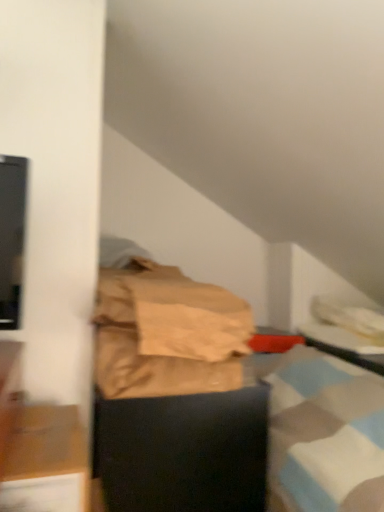
Question: From a real-world perspective, does brown paper bag at center stand above black glossy table at right?

Choices:
 (A) yes
 (B) no

Answer: (A)

Question: Is brown paper bag at center located outside black glossy table at right?

Choices:
 (A) yes
 (B) no

Answer: (A)

Question: Considering the relative sizes of brown paper bag at center and black glossy table at right in the image provided, is brown paper bag at center taller than black glossy table at right?

Choices:
 (A) yes
 (B) no

Answer: (A)

Question: Is brown paper bag at center at the right side of black glossy table at right?

Choices:
 (A) yes
 (B) no

Answer: (B)

Question: From the image's perspective, is brown paper bag at center over black glossy table at right?

Choices:
 (A) yes
 (B) no

Answer: (A)

Question: Is brown paper bag at center shorter than black glossy table at right?

Choices:
 (A) yes
 (B) no

Answer: (B)

Question: Is wooden cabinet at lower left, which appears as the first furniture when viewed from the front, completely or partially inside brown paper bag at center?

Choices:
 (A) no
 (B) yes

Answer: (A)

Question: Is brown paper bag at center further to camera compared to wooden cabinet at lower left, which appears as the first furniture when viewed from the front?

Choices:
 (A) yes
 (B) no

Answer: (A)

Question: Is brown paper bag at center in front of wooden cabinet at lower left, marked as the 2th furniture in a back-to-front arrangement?

Choices:
 (A) no
 (B) yes

Answer: (A)

Question: From a real-world perspective, is brown paper bag at center physically above wooden cabinet at lower left, which appears as the first furniture when viewed from the front?

Choices:
 (A) yes
 (B) no

Answer: (A)

Question: Does brown paper bag at center have a smaller size compared to wooden cabinet at lower left, marked as the 2th furniture in a back-to-front arrangement?

Choices:
 (A) no
 (B) yes

Answer: (A)

Question: Would you say brown paper bag at center is a long distance from wooden cabinet at lower left, which appears as the first furniture when viewed from the front?

Choices:
 (A) yes
 (B) no

Answer: (B)

Question: Could you tell me if wooden cabinet at lower left, marked as the 2th furniture in a back-to-front arrangement, is facing brown paper bag at center?

Choices:
 (A) no
 (B) yes

Answer: (A)